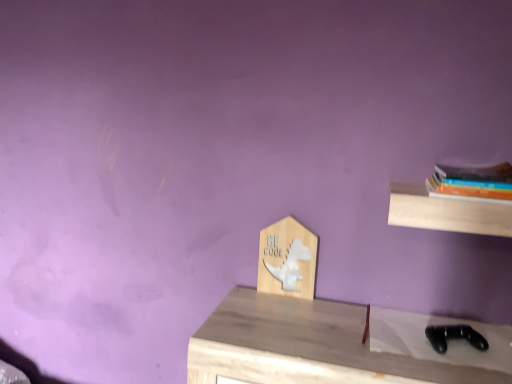
What do you see at coordinates (473, 181) in the screenshot? This screenshot has width=512, height=384. I see `multicolored paperbacks at upper right` at bounding box center [473, 181].

Identify the location of multicolored paperbacks at upper right. The width and height of the screenshot is (512, 384). (473, 181).

What is the approximate height of multicolored paperbacks at upper right?

It is 3.78 inches.

This screenshot has height=384, width=512. In order to click on multicolored paperbacks at upper right in this screenshot , I will do `click(473, 181)`.